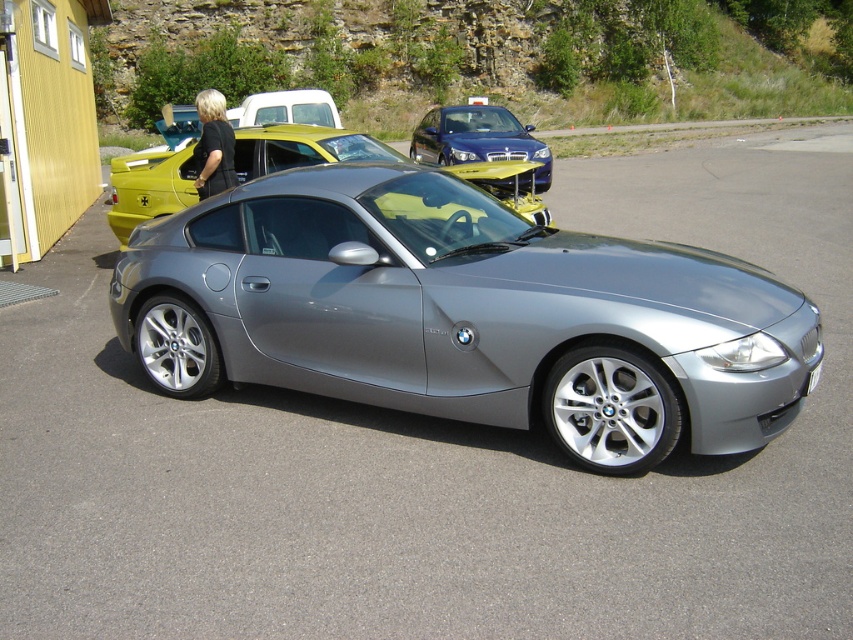
You are standing in front of the BMW Z4 and want to take a photo that includes both points marked as point 1 at coordinates (421, 195) and point 2 at coordinates (814, 372). Which point should you focus on first to ensure both are in focus?

You should focus on point 1 at coordinates (421, 195) first because it is closer to the camera than point 2 at coordinates (814, 372), ensuring both points are within the depth of field.

You are standing at the back of the BMW Z4 and want to walk to the point marked by point (485,163). However, there is an obstacle at point (737,392). Will you encounter this obstacle before reaching your destination?

Point (737,392) is in front of point (485,163), so yes, you will encounter the obstacle at point (737,392) before reaching your destination.